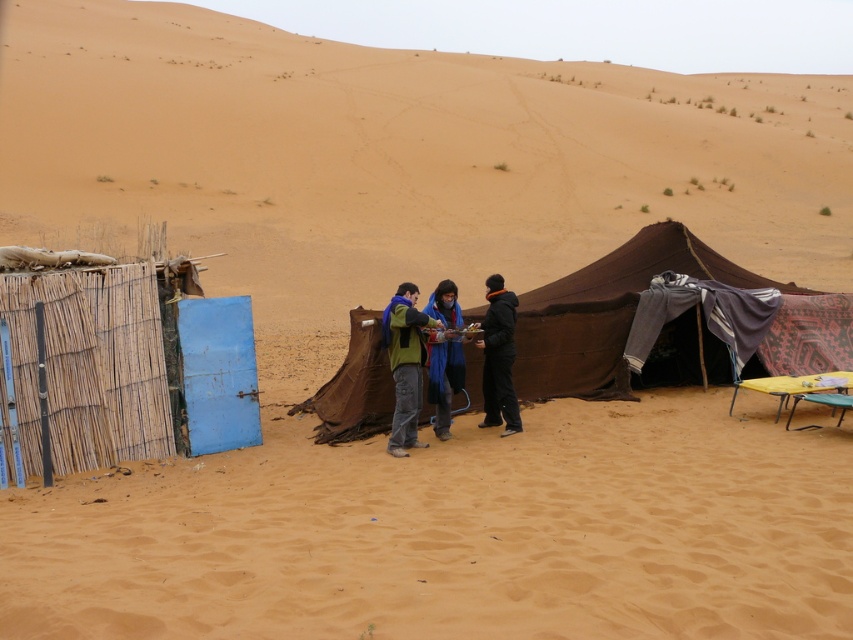
You are a hiker in the desert and need to decide where to place your backpack. You see a brown fabric tent at center and a black matte jacket at center. Which item is higher up and should you place your backpack underneath it?

The brown fabric tent at center is located above the black matte jacket at center, so you should place your backpack underneath the brown fabric tent at center.